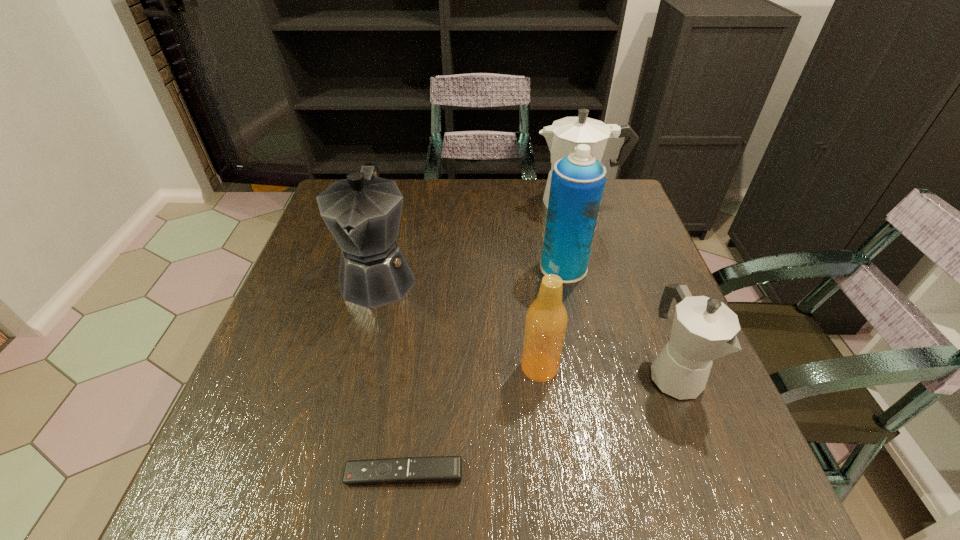
I want to click on blank space that satisfies the following two spatial constraints: 1. at the spout of the farthest object; 2. on the left side of the shortest coffeepot, so click(x=627, y=375).

The height and width of the screenshot is (540, 960). I want to click on free space that satisfies the following two spatial constraints: 1. at the spout of the farthest object; 2. on the right side of the nearest coffeepot, so click(x=627, y=375).

Identify the location of vacant region that satisfies the following two spatial constraints: 1. on the back side of the nearest coffeepot; 2. on the right side of the nearest object. (417, 375).

I want to click on free space that satisfies the following two spatial constraints: 1. at the spout of the farthest object; 2. on the front side of the beer bottle, so click(625, 367).